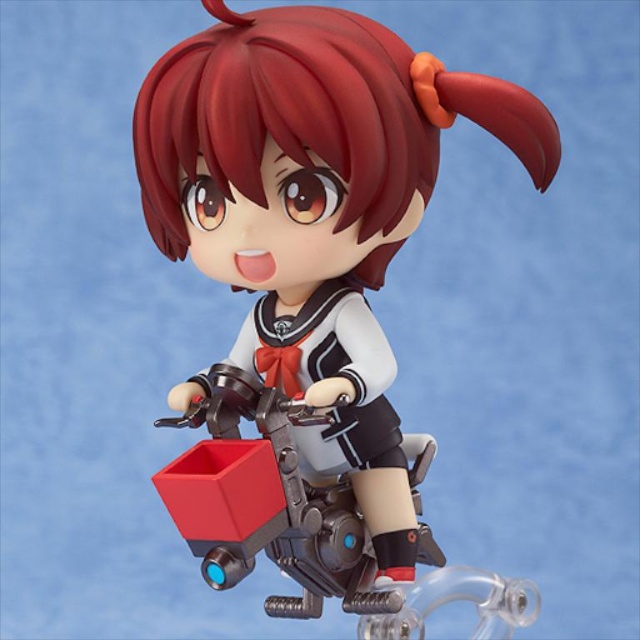
Can you confirm if matte black figure at center is smaller than satin red hair at center?

Incorrect, matte black figure at center is not smaller in size than satin red hair at center.

Identify the location of matte black figure at center. (312, 300).